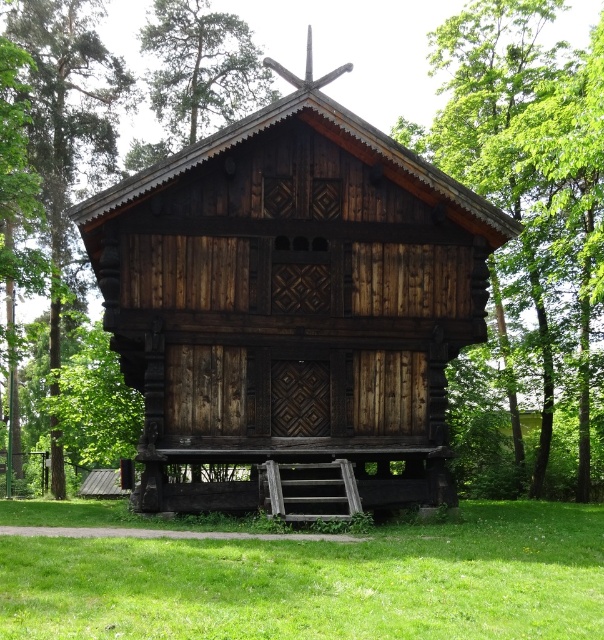
Question: In this image, where is dark brown wooden log cabin at center located relative to green wood tree at left?

Choices:
 (A) above
 (B) below

Answer: (B)

Question: Is green wood tree at left thinner than green wood tree at upper center?

Choices:
 (A) no
 (B) yes

Answer: (A)

Question: Which object is closer to the camera taking this photo?

Choices:
 (A) green wood tree at left
 (B) dark brown wooden log cabin at center
 (C) green leafy tree at upper right
 (D) green grass at lower center

Answer: (D)

Question: Among these points, which one is nearest to the camera?

Choices:
 (A) (416, 285)
 (B) (153, 104)
 (C) (463, 109)

Answer: (A)

Question: Is dark brown wooden log cabin at center closer to the viewer compared to green wood tree at upper center?

Choices:
 (A) yes
 (B) no

Answer: (A)

Question: Which object is closer to the camera taking this photo?

Choices:
 (A) green wood tree at left
 (B) green grass at lower center
 (C) dark brown wooden log cabin at center
 (D) green leafy tree at upper right

Answer: (B)